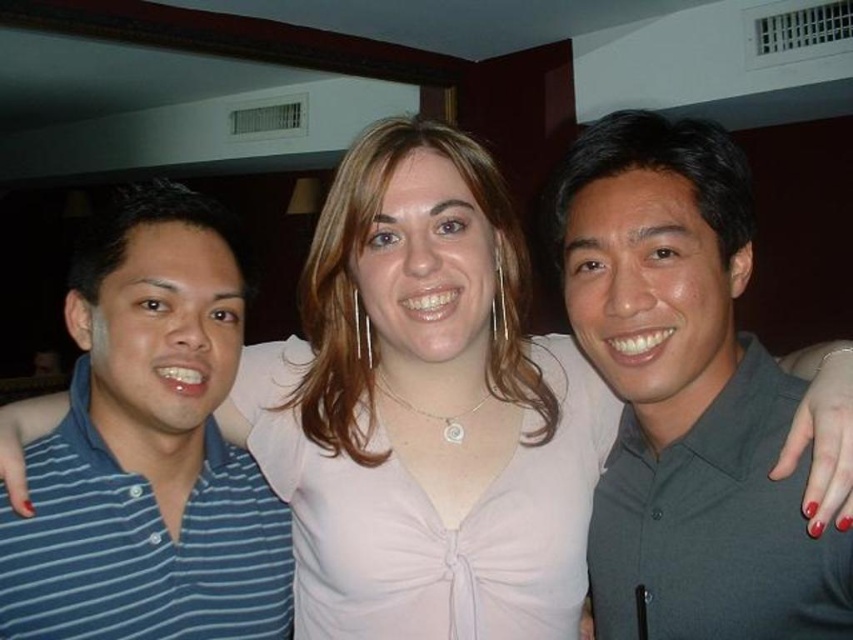
Question: Is gray matte shirt at center thinner than blue striped polo shirt at left?

Choices:
 (A) yes
 (B) no

Answer: (A)

Question: Which point appears farthest from the camera in this image?

Choices:
 (A) (723, 384)
 (B) (102, 518)

Answer: (B)

Question: Is gray matte shirt at center smaller than blue striped polo shirt at left?

Choices:
 (A) yes
 (B) no

Answer: (A)

Question: Does gray matte shirt at center lie behind blue striped polo shirt at left?

Choices:
 (A) yes
 (B) no

Answer: (B)